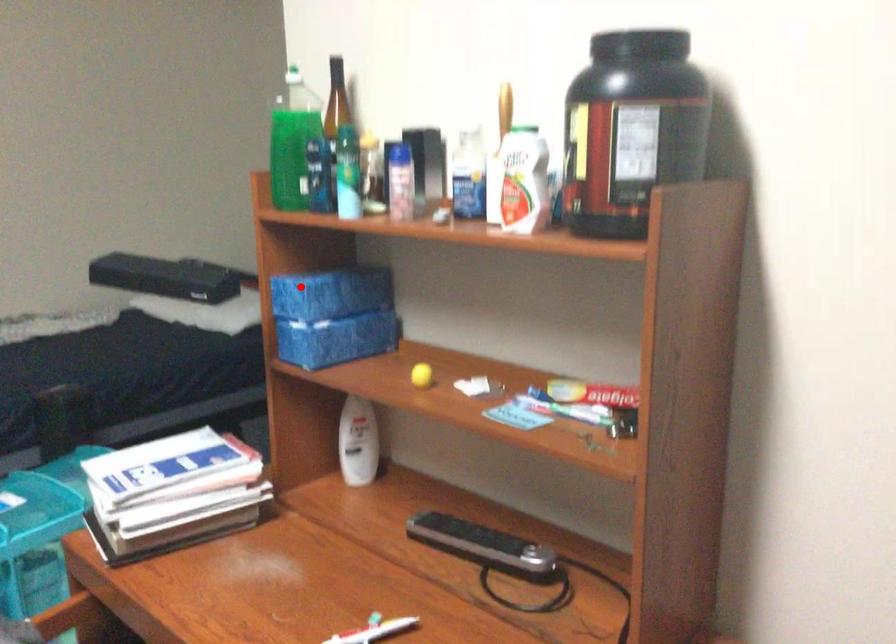
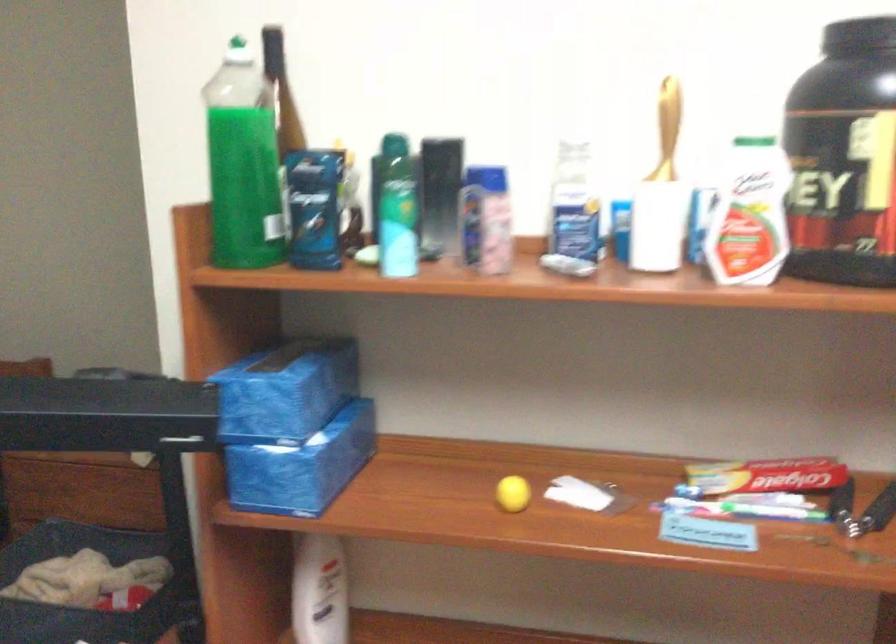
Question: I am providing you with two images of the same scene from different viewpoints. Image1 has a red point marked. In image2, the corresponding 3D location appears at what relative position? Reply with the corresponding letter.

Choices:
 (A) Closer
 (B) Farther

Answer: (A)